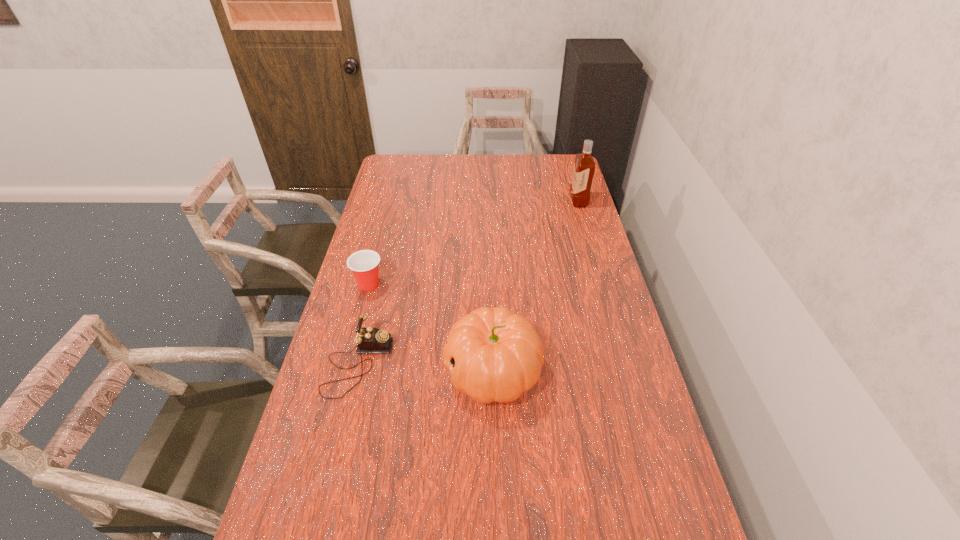
Locate an element on the screen. This screenshot has width=960, height=540. object that is the closest one to the second object from right to left is located at coordinates (369, 340).

Locate an element on the screen. The height and width of the screenshot is (540, 960). object that is the second closest to the telephone is located at coordinates (364, 264).